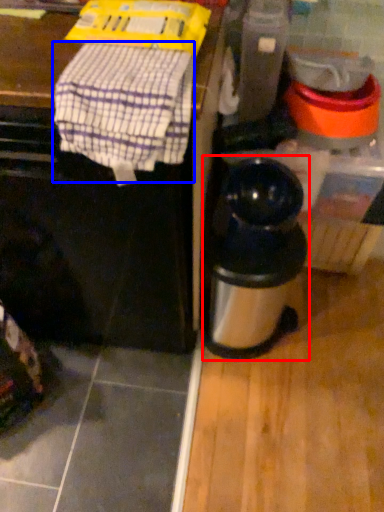
Question: Which point is closer to the camera, kitchen appliance (highlighted by a red box) or blanket (highlighted by a blue box)?

Choices:
 (A) kitchen appliance
 (B) blanket

Answer: (B)